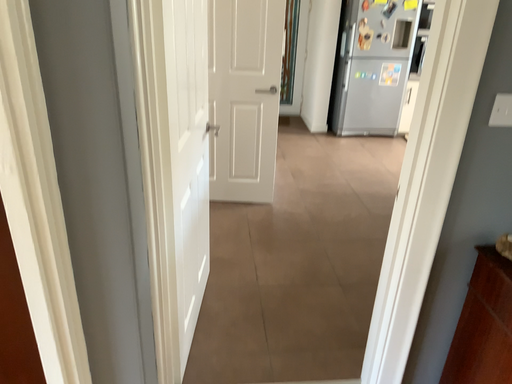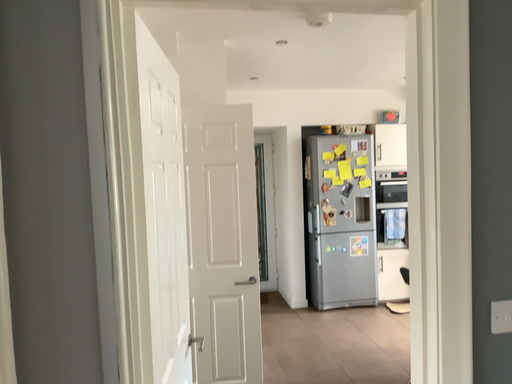
Question: How did the camera likely rotate when shooting the video?

Choices:
 (A) rotated downward
 (B) rotated upward

Answer: (B)